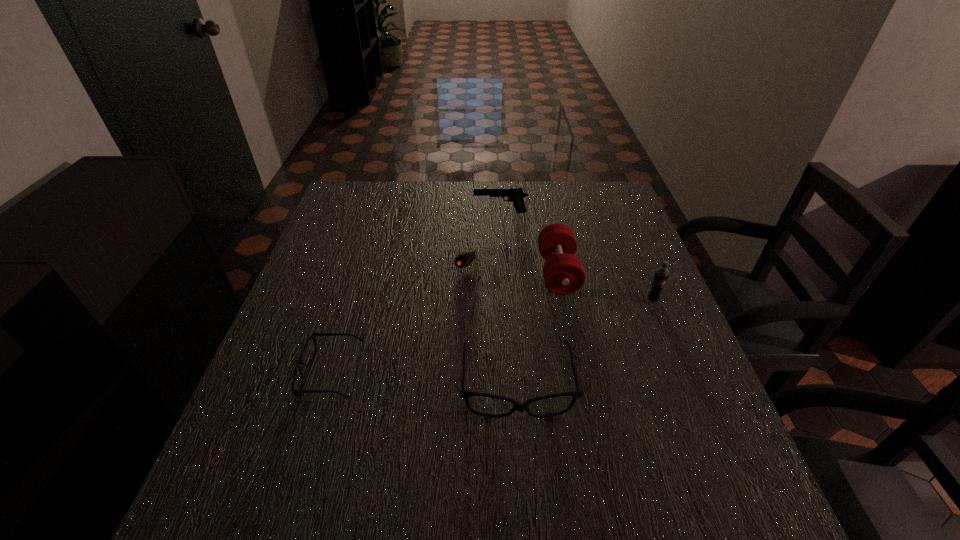
Locate an element on the screen. vacant space that satisfies the following two spatial constraints: 1. at the aiming end of the farthest object; 2. on the left side of the dumbbell is located at coordinates (504, 273).